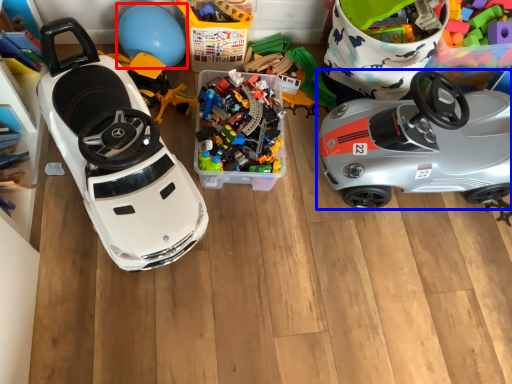
Question: Which of the following is the closest to the observer, balloon (highlighted by a red box) or car (highlighted by a blue box)?

Choices:
 (A) balloon
 (B) car

Answer: (B)